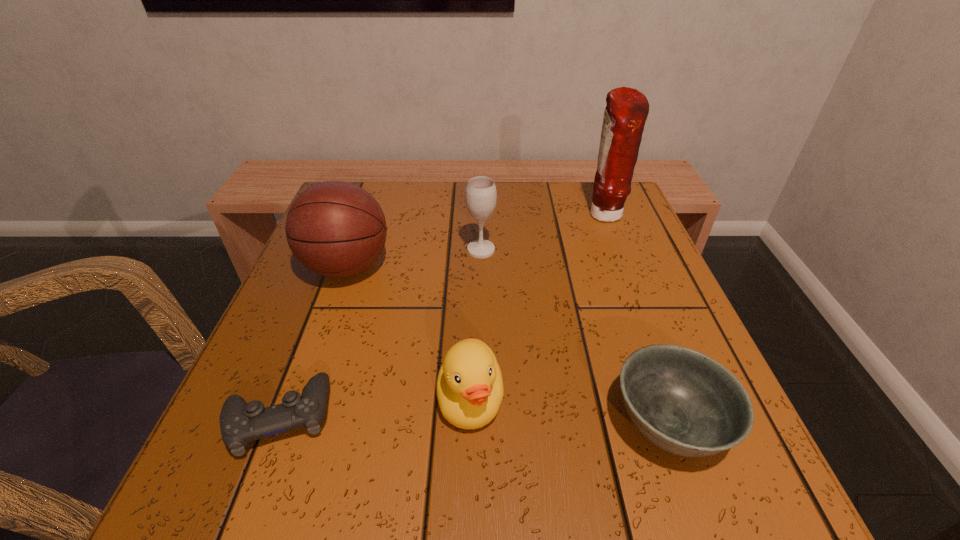
You are a GUI agent. You are given a task and a screenshot of the screen. Output one action in this format:
    pyautogui.click(x=<x>, y=<y>)
    Task: Click on the object situated at the near left corner
    
    Given the screenshot: What is the action you would take?
    pyautogui.click(x=240, y=423)

Where is `object situated at the far right corner`? The height and width of the screenshot is (540, 960). object situated at the far right corner is located at coordinates (627, 109).

Where is `object present at the near right corner`? object present at the near right corner is located at coordinates (686, 403).

In the image, there is a desktop. What are the coordinates of `vacant space at the far edge` in the screenshot? It's located at (559, 210).

Find the location of `free space at the near edge of the desktop`. free space at the near edge of the desktop is located at coordinates (501, 463).

In the image, there is a desktop. In order to click on free space at the left edge in this screenshot , I will do `click(276, 334)`.

I want to click on vacant space at the far left corner of the desktop, so click(377, 187).

The image size is (960, 540). Find the location of `free space at the near left corner of the desktop`. free space at the near left corner of the desktop is located at coordinates (216, 504).

Where is `free space at the far right corner of the desktop`? The height and width of the screenshot is (540, 960). free space at the far right corner of the desktop is located at coordinates [x=627, y=199].

The height and width of the screenshot is (540, 960). I want to click on free spot between the shortest object and the fourth tallest object, so click(374, 408).